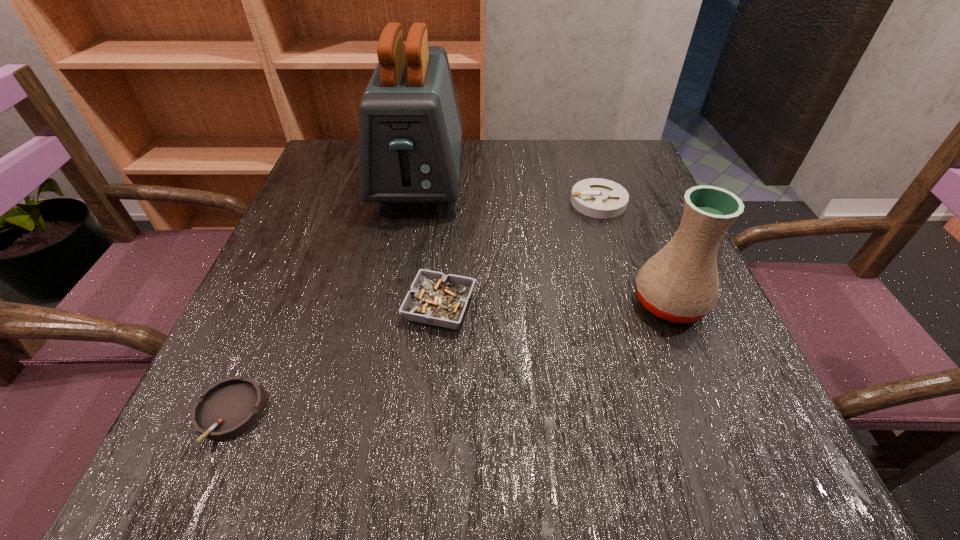
Where is `unoccupied position between the second ashtray from right to left and the pottery`? The height and width of the screenshot is (540, 960). unoccupied position between the second ashtray from right to left and the pottery is located at coordinates (555, 305).

Locate an element on the screen. vacant area that lies between the second ashtray from right to left and the tallest object is located at coordinates tap(429, 242).

Locate an element on the screen. The width and height of the screenshot is (960, 540). free space between the second tallest object and the rightmost ashtray is located at coordinates (634, 252).

Locate an element on the screen. This screenshot has width=960, height=540. free space between the farthest ashtray and the tallest object is located at coordinates (509, 190).

Where is `free space that is in between the second ashtray from left to right and the nearest ashtray`? This screenshot has width=960, height=540. free space that is in between the second ashtray from left to right and the nearest ashtray is located at coordinates (334, 361).

I want to click on free space between the nearest ashtray and the toaster, so click(x=324, y=296).

You are a GUI agent. You are given a task and a screenshot of the screen. Output one action in this format:
    pyautogui.click(x=<x>, y=<y>)
    Task: Click on the vacant space in between the second nearest ashtray and the shortest object
    The width and height of the screenshot is (960, 540).
    Given the screenshot: What is the action you would take?
    pyautogui.click(x=334, y=361)

Point out which object is positioned as the nearest to the rightmost ashtray. Please provide its 2D coordinates. Your answer should be formatted as a tuple, i.e. [(x, y)], where the tuple contains the x and y coordinates of a point satisfying the conditions above.

[(680, 283)]

The image size is (960, 540). Find the location of `object identified as the second closest to the leftmost object`. object identified as the second closest to the leftmost object is located at coordinates (410, 130).

Identify which ashtray is located as the third nearest to the tallest object. Please provide its 2D coordinates. Your answer should be formatted as a tuple, i.e. [(x, y)], where the tuple contains the x and y coordinates of a point satisfying the conditions above.

[(229, 407)]